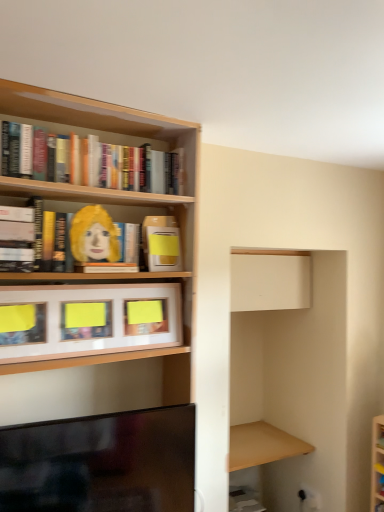
This screenshot has height=512, width=384. Describe the element at coordinates (161, 243) in the screenshot. I see `matte yellow book at upper center, acting as the 4th book starting from the top` at that location.

Consider the image. What is the approximate height of hardcover book at left, the 3th book when ordered from top to bottom?

20.93 centimeters.

Where is `matte yellow book at upper left, the 3th book ordered from the bottom`? matte yellow book at upper left, the 3th book ordered from the bottom is located at coordinates 155,211.

Locate an element on the screen. wooden frame at center, acting as the 2th cabinet starting from the right is located at coordinates (86, 322).

Measure the distance between black glossy tv at lower left and camera.

The distance of black glossy tv at lower left from camera is 4.06 feet.

The width and height of the screenshot is (384, 512). Find the location of `matte yellow book at upper center, acting as the 4th book starting from the top`. matte yellow book at upper center, acting as the 4th book starting from the top is located at coordinates (161, 243).

How distant is white matte cabinet at upper center, which is counted as the first cabinet, starting from the right, from hardcover books at upper left, the 4th book when ordered from bottom to top?

The distance of white matte cabinet at upper center, which is counted as the first cabinet, starting from the right, from hardcover books at upper left, the 4th book when ordered from bottom to top, is 37.36 inches.

Who is smaller, white matte cabinet at upper center, which is counted as the first cabinet, starting from the right, or hardcover books at upper left, the 4th book when ordered from bottom to top?

Smaller between the two is hardcover books at upper left, the 4th book when ordered from bottom to top.

Which is correct: white matte cabinet at upper center, the 1th cabinet viewed from the back, is inside hardcover books at upper left, which is counted as the 1th book, starting from the top, or outside of it?

white matte cabinet at upper center, the 1th cabinet viewed from the back, is outside hardcover books at upper left, which is counted as the 1th book, starting from the top.

This screenshot has width=384, height=512. I want to click on cabinet that is the 1st one when counting downward from the hardcover books at upper left, the 4th book when ordered from bottom to top (from the image's perspective), so 270,279.

Which is in front, matte yellow paper at upper left or white matte cabinet at upper center, which is counted as the first cabinet, starting from the right?

matte yellow paper at upper left.

Could you tell me if matte yellow paper at upper left is turned towards white matte cabinet at upper center, arranged as the 2th cabinet when viewed from the left?

No, matte yellow paper at upper left does not turn towards white matte cabinet at upper center, arranged as the 2th cabinet when viewed from the left.

Does matte yellow paper at upper left have a smaller size compared to white matte cabinet at upper center, arranged as the 2th cabinet when viewed from the left?

Yes.

From a real-world perspective, is matte yellow paper at upper left beneath white matte cabinet at upper center, arranged as the 2th cabinet when viewed from the left?

No.

Considering the positions of points (296, 442) and (246, 300), is point (296, 442) farther from camera compared to point (246, 300)?

Yes, point (296, 442) is behind point (246, 300).

From a real-world perspective, is wooden at right positioned above or below white matte cabinet at upper center, the 1th cabinet viewed from the back?

From a real-world perspective, wooden at right is physically below white matte cabinet at upper center, the 1th cabinet viewed from the back.

Would you say wooden at right is a long distance from white matte cabinet at upper center, which is counted as the first cabinet, starting from the right?

They are positioned close to each other.

Is wooden at right situated inside white matte cabinet at upper center, which is counted as the first cabinet, starting from the right, or outside?

wooden at right is outside white matte cabinet at upper center, which is counted as the first cabinet, starting from the right.

From the picture: Is matte yellow book at upper left, the 3th book ordered from the bottom, facing away from black glossy tv at lower left?

No, matte yellow book at upper left, the 3th book ordered from the bottom,'s orientation is not away from black glossy tv at lower left.

Is matte yellow book at upper left, the 3th book ordered from the bottom, bigger or smaller than black glossy tv at lower left?

In the image, matte yellow book at upper left, the 3th book ordered from the bottom, appears to be smaller than black glossy tv at lower left.

Are matte yellow book at upper left, which is the 2th book from top to bottom, and black glossy tv at lower left making contact?

They are not placed beside each other.

Which book is the 3rd one when counting from the back of the black glossy tv at lower left? Please provide its 2D coordinates.

[(155, 211)]

Is hardcover book at left, acting as the 2th book starting from the bottom, facing away from white matte cabinet at upper center, which is counted as the first cabinet, starting from the right?

No, hardcover book at left, acting as the 2th book starting from the bottom,'s orientation is not away from white matte cabinet at upper center, which is counted as the first cabinet, starting from the right.

From a real-world perspective, which book is the 2nd one above the white matte cabinet at upper center, which is counted as the first cabinet, starting from the right? Please provide its 2D coordinates.

[(23, 236)]

From a real-world perspective, is hardcover book at left, the 3th book when ordered from top to bottom, positioned under white matte cabinet at upper center, which is counted as the first cabinet, starting from the right, based on gravity?

No, from a real-world perspective, hardcover book at left, the 3th book when ordered from top to bottom, is not beneath white matte cabinet at upper center, which is counted as the first cabinet, starting from the right.

Which is correct: hardcover book at left, the 3th book when ordered from top to bottom, is inside white matte cabinet at upper center, the 1th cabinet viewed from the back, or outside of it?

The correct answer is: outside.

Can you confirm if wooden frame at center, marked as the 1th cabinet in a front-to-back arrangement, is shorter than white matte cabinet at upper center, the second cabinet in the front-to-back sequence?

Yes.

Is wooden frame at center, acting as the 2th cabinet starting from the right, to the right of white matte cabinet at upper center, arranged as the 2th cabinet when viewed from the left, from the viewer's perspective?

In fact, wooden frame at center, acting as the 2th cabinet starting from the right, is to the left of white matte cabinet at upper center, arranged as the 2th cabinet when viewed from the left.

Can white matte cabinet at upper center, arranged as the 2th cabinet when viewed from the left, be found inside wooden frame at center, which is the second cabinet from back to front?

Definitely not — white matte cabinet at upper center, arranged as the 2th cabinet when viewed from the left, is not inside wooden frame at center, which is the second cabinet from back to front.

Would you say wooden frame at center, which is the 1th cabinet from left to right, is a long distance from white matte cabinet at upper center, arranged as the 2th cabinet when viewed from the left?

wooden frame at center, which is the 1th cabinet from left to right, is actually quite close to white matte cabinet at upper center, arranged as the 2th cabinet when viewed from the left.

From the image's perspective, is wooden at right located beneath hardcover book at left, acting as the 2th book starting from the bottom?

Yes, from the image's perspective, wooden at right is beneath hardcover book at left, acting as the 2th book starting from the bottom.

In the scene shown: Is wooden at right taller than hardcover book at left, acting as the 2th book starting from the bottom?

Incorrect, the height of wooden at right is not larger of that of hardcover book at left, acting as the 2th book starting from the bottom.

Between point (297, 446) and point (30, 216), which one is positioned behind?

The point (297, 446) is behind.

The width and height of the screenshot is (384, 512). In order to click on the 2nd book to the left of the white matte cabinet at upper center, which is counted as the first cabinet, starting from the right, counting from the anchor's position in this screenshot , I will do `click(90, 161)`.

From the image's perspective, which cabinet is the 1st one below the matte yellow paper at upper left? Please provide its 2D coordinates.

[(270, 279)]

Which object lies further to the anchor point hardcover book at left, the 3th book when ordered from top to bottom, matte yellow book at upper left, the 3th book ordered from the bottom, or white matte cabinet at upper center, the 1th cabinet viewed from the back?

white matte cabinet at upper center, the 1th cabinet viewed from the back, lies further to hardcover book at left, the 3th book when ordered from top to bottom, than the other object.

In the scene shown: From the image, which object appears to be nearer to white matte cabinet at upper center, arranged as the 2th cabinet when viewed from the left, matte yellow book at upper left, which is the 2th book from top to bottom, or matte yellow book at upper center, arranged as the first book when ordered from the bottom?

Among the two, matte yellow book at upper left, which is the 2th book from top to bottom, is located nearer to white matte cabinet at upper center, arranged as the 2th cabinet when viewed from the left.

Based on their spatial positions, is hardcover books at upper left, the 4th book when ordered from bottom to top, or wooden frame at center, which is the second cabinet from back to front, further from matte yellow book at upper left, the 3th book ordered from the bottom?

wooden frame at center, which is the second cabinet from back to front, lies further to matte yellow book at upper left, the 3th book ordered from the bottom, than the other object.

When comparing their distances from matte yellow book at upper center, acting as the 4th book starting from the top, does hardcover books at upper left, the 4th book when ordered from bottom to top, or wooden at right seem closer?

The object closer to matte yellow book at upper center, acting as the 4th book starting from the top, is hardcover books at upper left, the 4th book when ordered from bottom to top.

Looking at the image, which one is located further to matte yellow paper at upper left, wooden at right or wooden frame at center, acting as the 2th cabinet starting from the right?

wooden at right is positioned further to the anchor matte yellow paper at upper left.

Estimate the real-world distances between objects in this image. Which object is further from matte yellow book at upper center, arranged as the first book when ordered from the bottom, white matte cabinet at upper center, the second cabinet in the front-to-back sequence, or hardcover book at left, the 3th book when ordered from top to bottom?

white matte cabinet at upper center, the second cabinet in the front-to-back sequence.

From the image, which object appears to be farther from matte yellow book at upper left, the 3th book ordered from the bottom, matte yellow book at upper center, arranged as the first book when ordered from the bottom, or wooden frame at center, marked as the 1th cabinet in a front-to-back arrangement?

The object further to matte yellow book at upper left, the 3th book ordered from the bottom, is wooden frame at center, marked as the 1th cabinet in a front-to-back arrangement.

From the image, which object appears to be nearer to hardcover books at upper left, which is counted as the 1th book, starting from the top, hardcover book at left, the 3th book when ordered from top to bottom, or matte yellow book at upper center, arranged as the first book when ordered from the bottom?

Based on the image, hardcover book at left, the 3th book when ordered from top to bottom, appears to be nearer to hardcover books at upper left, which is counted as the 1th book, starting from the top.

What are the coordinates of `cabinet between black glossy tv at lower left and wooden at right in the front-back direction` in the screenshot? It's located at (86, 322).

Where is `book between hardcover books at upper left, the 4th book when ordered from bottom to top, and hardcover book at left, acting as the 2th book starting from the bottom, in the vertical direction`? Image resolution: width=384 pixels, height=512 pixels. book between hardcover books at upper left, the 4th book when ordered from bottom to top, and hardcover book at left, acting as the 2th book starting from the bottom, in the vertical direction is located at coordinates [x=155, y=211].

Find the location of a particular element. The image size is (384, 512). person between matte yellow book at upper left, which is the 2th book from top to bottom, and white matte cabinet at upper center, which is counted as the first cabinet, starting from the right, from front to back is located at coordinates (94, 236).

Image resolution: width=384 pixels, height=512 pixels. What are the coordinates of `book positioned between matte yellow book at upper left, which is the 2th book from top to bottom, and white matte cabinet at upper center, the 1th cabinet viewed from the back, from near to far` in the screenshot? It's located at (161, 243).